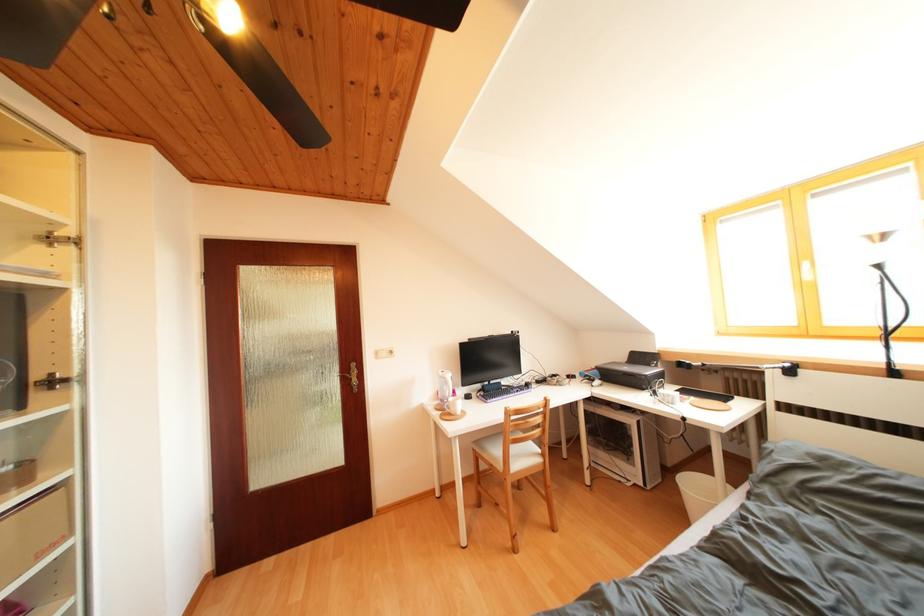
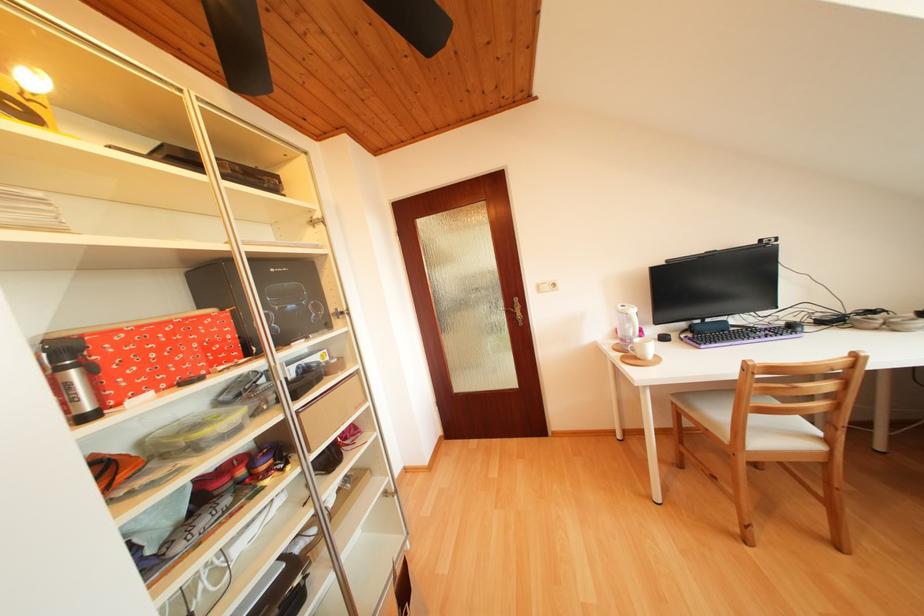
Question: The camera is either moving clockwise (left) or counter-clockwise (right) around the object. The first image is from the beginning of the video and the second image is from the end. Is the camera moving left or right when shooting the video?

Choices:
 (A) Left
 (B) Right

Answer: (B)